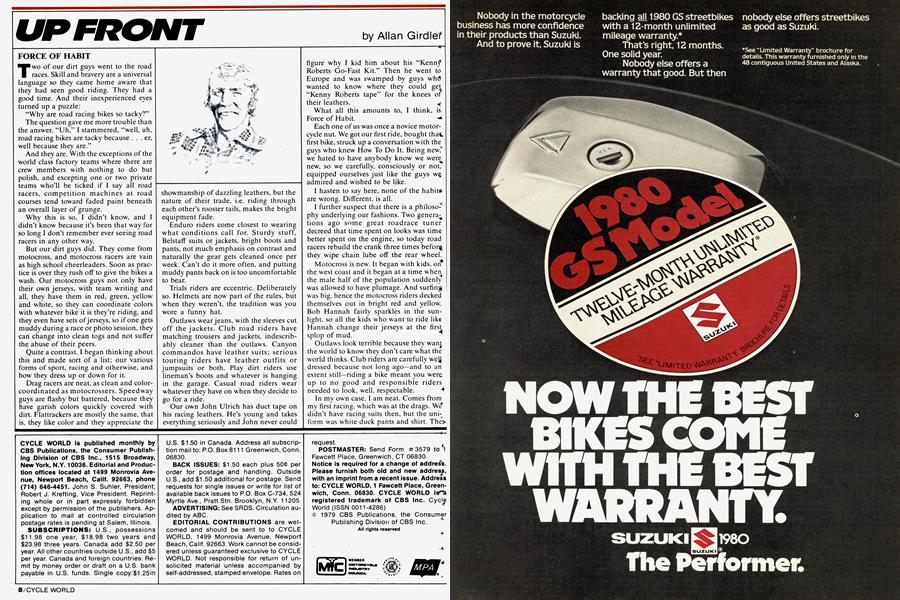
Find the location of a particular element. Image resolution: width=900 pixels, height=600 pixels. newspaper is located at coordinates (196, 284).